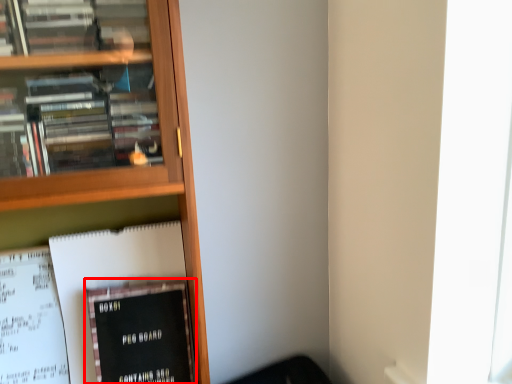
Question: Considering the relative positions of book (annotated by the red box) and book in the image provided, where is book (annotated by the red box) located with respect to the staircase?

Choices:
 (A) right
 (B) left

Answer: (A)